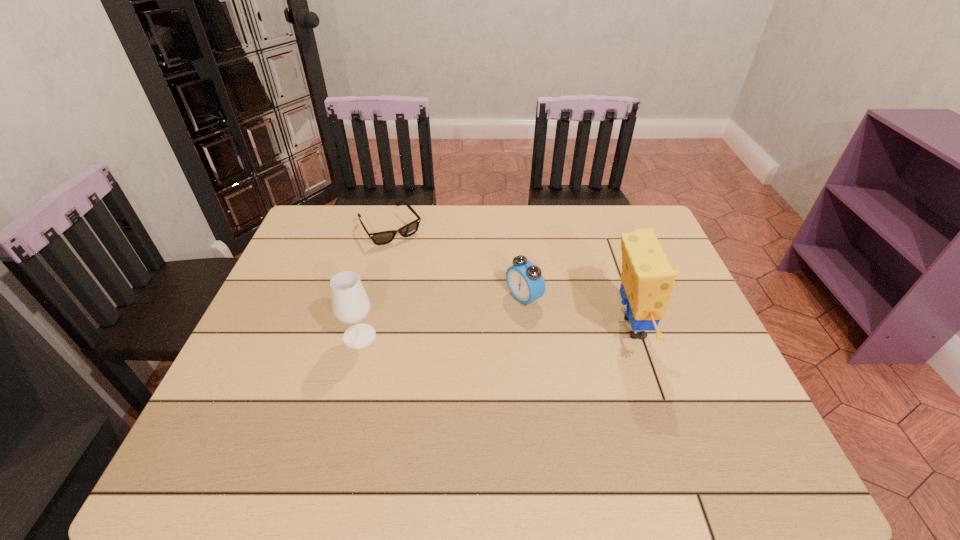
The image size is (960, 540). What are the coordinates of `free point between the third object from left to right and the third shortest object` in the screenshot? It's located at (442, 316).

You are a GUI agent. You are given a task and a screenshot of the screen. Output one action in this format:
    pyautogui.click(x=<x>, y=<y>)
    Task: Click on the object that is the second closest to the alarm clock
    
    Given the screenshot: What is the action you would take?
    (379, 238)

Locate which object ranks in proximity to the farthest object. Please provide its 2D coordinates. Your answer should be formatted as a tuple, i.e. [(x, y)], where the tuple contains the x and y coordinates of a point satisfying the conditions above.

[(524, 279)]

In order to click on vacant area in the image that satisfies the following two spatial constraints: 1. on the front side of the farthest object; 2. on the face of the sponge in this screenshot , I will do `click(366, 328)`.

Locate an element on the screen. free spot that satisfies the following two spatial constraints: 1. on the back side of the third shortest object; 2. on the face of the sponge is located at coordinates (362, 328).

In order to click on free space that satisfies the following two spatial constraints: 1. on the front side of the sunglasses; 2. on the right side of the second shortest object in this screenshot , I will do `click(373, 297)`.

Identify the location of vacant region that satisfies the following two spatial constraints: 1. on the front side of the shortest object; 2. on the face of the rightmost object. (366, 328).